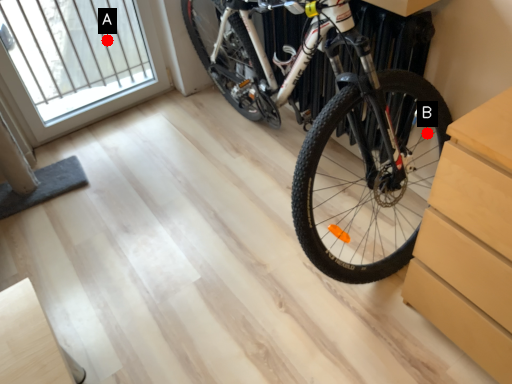
Question: Two points are circled on the image, labeled by A and B beside each circle. Which of the following is the closest to the observer?

Choices:
 (A) A is closer
 (B) B is closer

Answer: (B)